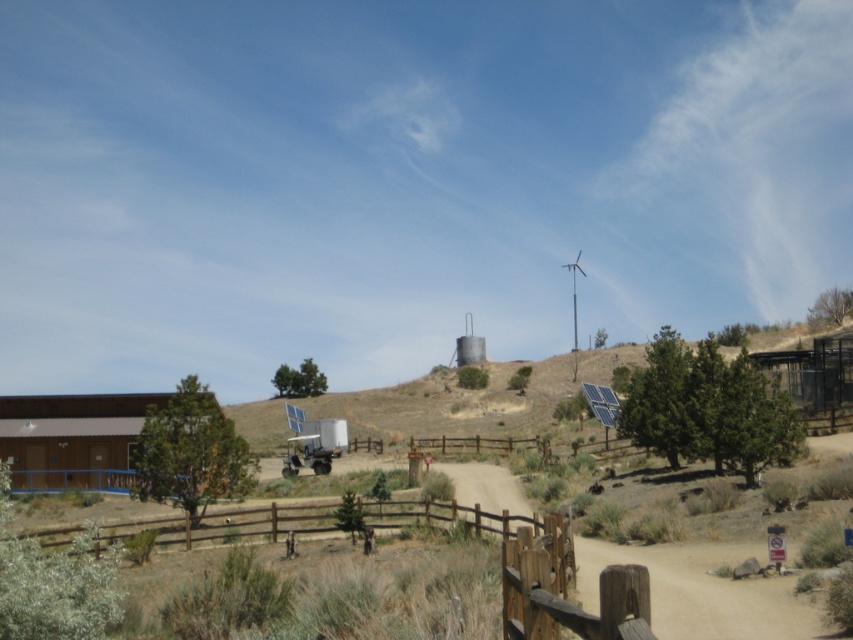
Question: Which point is farther to the camera?

Choices:
 (A) white plastic wind turbine at upper center
 (B) brown dirt hillside at center
 (C) wooden fence at lower center

Answer: (A)

Question: Which is farther from the white plastic wind turbine at upper center?

Choices:
 (A) wooden fence at lower center
 (B) brown dirt hillside at center
 (C) metallic gray silo at center

Answer: (A)

Question: Is brown dirt hillside at center thinner than white plastic wind turbine at upper center?

Choices:
 (A) yes
 (B) no

Answer: (B)

Question: Can you confirm if brown dirt hillside at center is positioned below wooden fence at lower center?

Choices:
 (A) yes
 (B) no

Answer: (A)

Question: Based on their relative distances, which object is farther from the metallic gray silo at center?

Choices:
 (A) wooden fence at lower center
 (B) white plastic wind turbine at upper center

Answer: (A)

Question: Does brown dirt hillside at center have a smaller size compared to white plastic wind turbine at upper center?

Choices:
 (A) yes
 (B) no

Answer: (B)